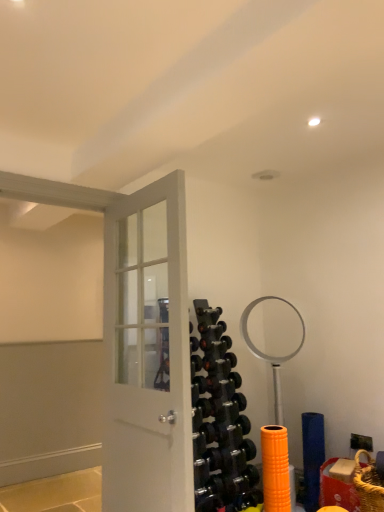
Image resolution: width=384 pixels, height=512 pixels. Describe the element at coordinates (218, 383) in the screenshot. I see `black rubber dumbbell at center, which is counted as the first dumbbell, starting from the bottom` at that location.

What do you see at coordinates (147, 353) in the screenshot?
I see `white glossy door at center` at bounding box center [147, 353].

This screenshot has width=384, height=512. What do you see at coordinates (219, 361) in the screenshot?
I see `black rubber dumbbell at center, placed as the 2th dumbbell when sorted from bottom to top` at bounding box center [219, 361].

Where is `black rubber dumbbell at center, which is counted as the first dumbbell, starting from the bottom`? black rubber dumbbell at center, which is counted as the first dumbbell, starting from the bottom is located at coordinates (218, 383).

From a real-world perspective, is black rubber dumbbell at center, arranged as the 3th dumbbell when viewed from the top, positioned over white glossy door at center based on gravity?

No, from a real-world perspective, black rubber dumbbell at center, arranged as the 3th dumbbell when viewed from the top, is not over white glossy door at center

At what (x,y) coordinates should I click in order to perform the action: click on the 1st dumbbell behind when counting from the white glossy door at center. Please return your answer as a coordinate pair (x, y). Looking at the image, I should click on (218, 383).

What's the angular difference between black rubber dumbbell at center, arranged as the 3th dumbbell when viewed from the top, and white glossy door at center's facing directions?

The angular difference between black rubber dumbbell at center, arranged as the 3th dumbbell when viewed from the top, and white glossy door at center is 89.5 degrees.

Does black rubber dumbbell at center, which is counted as the first dumbbell, starting from the bottom, have a greater height compared to white glossy door at center?

In fact, black rubber dumbbell at center, which is counted as the first dumbbell, starting from the bottom, may be shorter than white glossy door at center.

Considering the sizes of objects black rubber dumbbell at center, which is counted as the first dumbbell, starting from the top, and black rubber dumbbell at center, placed as the 2th dumbbell when sorted from bottom to top, in the image provided, who is taller, black rubber dumbbell at center, which is counted as the first dumbbell, starting from the top, or black rubber dumbbell at center, placed as the 2th dumbbell when sorted from bottom to top,?

With more height is black rubber dumbbell at center, placed as the 2th dumbbell when sorted from bottom to top.

From a real-world perspective, is black rubber dumbbell at center, acting as the 3th dumbbell starting from the bottom, above or below black rubber dumbbell at center, the 2th dumbbell in the top-to-bottom sequence?

From a real-world perspective, black rubber dumbbell at center, acting as the 3th dumbbell starting from the bottom, is physically above black rubber dumbbell at center, the 2th dumbbell in the top-to-bottom sequence.

Considering the positions of point (203, 344) and point (220, 361), is point (203, 344) closer or farther from the camera than point (220, 361)?

Point (203, 344).

Which of these two, black rubber dumbbell at center, acting as the 3th dumbbell starting from the bottom, or white glossy door at center, is wider?

With larger width is white glossy door at center.

Is white glossy door at center inside black rubber dumbbell at center, acting as the 3th dumbbell starting from the bottom?

No, white glossy door at center is not a part of black rubber dumbbell at center, acting as the 3th dumbbell starting from the bottom.

Can you confirm if black rubber dumbbell at center, which is counted as the first dumbbell, starting from the top, is shorter than white glossy door at center?

Yes.

How many degrees apart are the facing directions of black rubber dumbbell at center, acting as the 3th dumbbell starting from the bottom, and white glossy door at center?

92.3 degrees.

From the image's perspective, is black rubber dumbbell at center, arranged as the 3th dumbbell when viewed from the top, above black rubber dumbbell at center, acting as the 3th dumbbell starting from the bottom?

Actually, black rubber dumbbell at center, arranged as the 3th dumbbell when viewed from the top, appears below black rubber dumbbell at center, acting as the 3th dumbbell starting from the bottom, in the image.

Which is less distant, (197,378) or (214,347)?

Point (197,378) appears to be closer to the viewer than point (214,347).

Could you tell me if black rubber dumbbell at center, which is counted as the first dumbbell, starting from the bottom, is turned towards black rubber dumbbell at center, acting as the 3th dumbbell starting from the bottom?

No.

Is black rubber dumbbell at center, arranged as the 3th dumbbell when viewed from the top, positioned far away from black rubber dumbbell at center, which is counted as the first dumbbell, starting from the top?

black rubber dumbbell at center, arranged as the 3th dumbbell when viewed from the top, is near black rubber dumbbell at center, which is counted as the first dumbbell, starting from the top, not far away.

Locate an element on the screen. This screenshot has width=384, height=512. door that appears above the black rubber dumbbell at center, arranged as the 3th dumbbell when viewed from the top (from the image's perspective) is located at coordinates (147, 353).

From their relative heights in the image, would you say white glossy door at center is taller or shorter than black rubber dumbbell at center, which is counted as the first dumbbell, starting from the bottom?

white glossy door at center is taller than black rubber dumbbell at center, which is counted as the first dumbbell, starting from the bottom.

Does point (134, 263) lie behind point (213, 387)?

Yes, it is behind point (213, 387).

Does white glossy door at center come in front of black rubber dumbbell at center, which is counted as the first dumbbell, starting from the bottom?

Yes, white glossy door at center is closer to the viewer.

The height and width of the screenshot is (512, 384). In order to click on the 2nd dumbbell positioned above the black rubber dumbbell at center, which is counted as the first dumbbell, starting from the bottom (from a real-world perspective) in this screenshot , I will do `click(215, 343)`.

Is black rubber dumbbell at center, which is counted as the first dumbbell, starting from the top, wider or thinner than black rubber dumbbell at center, which is counted as the first dumbbell, starting from the bottom?

Clearly, black rubber dumbbell at center, which is counted as the first dumbbell, starting from the top, has less width compared to black rubber dumbbell at center, which is counted as the first dumbbell, starting from the bottom.

Would you say black rubber dumbbell at center, which is counted as the first dumbbell, starting from the top, is outside black rubber dumbbell at center, which is counted as the first dumbbell, starting from the bottom?

Indeed, black rubber dumbbell at center, which is counted as the first dumbbell, starting from the top, is completely outside black rubber dumbbell at center, which is counted as the first dumbbell, starting from the bottom.

Is black rubber dumbbell at center, which is counted as the first dumbbell, starting from the top, oriented away from black rubber dumbbell at center, arranged as the 3th dumbbell when viewed from the top?

No, black rubber dumbbell at center, which is counted as the first dumbbell, starting from the top,'s orientation is not away from black rubber dumbbell at center, arranged as the 3th dumbbell when viewed from the top.

Considering the positions of objects black rubber dumbbell at center, placed as the 2th dumbbell when sorted from bottom to top, and white glossy door at center in the image provided, who is more to the right, black rubber dumbbell at center, placed as the 2th dumbbell when sorted from bottom to top, or white glossy door at center?

From the viewer's perspective, black rubber dumbbell at center, placed as the 2th dumbbell when sorted from bottom to top, appears more on the right side.

Can you confirm if black rubber dumbbell at center, the 2th dumbbell in the top-to-bottom sequence, is shorter than white glossy door at center?

Yes, black rubber dumbbell at center, the 2th dumbbell in the top-to-bottom sequence, is shorter than white glossy door at center.

From the image's perspective, is black rubber dumbbell at center, placed as the 2th dumbbell when sorted from bottom to top, below white glossy door at center?

Indeed, from the image's perspective, black rubber dumbbell at center, placed as the 2th dumbbell when sorted from bottom to top, is shown beneath white glossy door at center.

Image resolution: width=384 pixels, height=512 pixels. What are the coordinates of `dumbbell that is the 1st object located behind the white glossy door at center` in the screenshot? It's located at (218, 383).

Locate an element on the screen. The width and height of the screenshot is (384, 512). the 1st dumbbell counting from the right side of the black rubber dumbbell at center, which is counted as the first dumbbell, starting from the top is located at coordinates (219, 361).

Based on their spatial positions, is black rubber dumbbell at center, placed as the 2th dumbbell when sorted from bottom to top, or white glossy door at center closer to black rubber dumbbell at center, which is counted as the first dumbbell, starting from the bottom?

black rubber dumbbell at center, placed as the 2th dumbbell when sorted from bottom to top.

From the image, which object appears to be farther from black rubber dumbbell at center, which is counted as the first dumbbell, starting from the top, white glossy door at center or black rubber dumbbell at center, the 2th dumbbell in the top-to-bottom sequence?

white glossy door at center.

Based on their spatial positions, is black rubber dumbbell at center, placed as the 2th dumbbell when sorted from bottom to top, or white glossy door at center further from black rubber dumbbell at center, acting as the 3th dumbbell starting from the bottom?

Among the two, white glossy door at center is located further to black rubber dumbbell at center, acting as the 3th dumbbell starting from the bottom.

Based on their spatial positions, is black rubber dumbbell at center, placed as the 2th dumbbell when sorted from bottom to top, or black rubber dumbbell at center, which is counted as the first dumbbell, starting from the top, further from black rubber dumbbell at center, arranged as the 3th dumbbell when viewed from the top?

black rubber dumbbell at center, which is counted as the first dumbbell, starting from the top, lies further to black rubber dumbbell at center, arranged as the 3th dumbbell when viewed from the top, than the other object.

From the image, which object appears to be nearer to white glossy door at center, black rubber dumbbell at center, acting as the 3th dumbbell starting from the bottom, or black rubber dumbbell at center, arranged as the 3th dumbbell when viewed from the top?

Based on the image, black rubber dumbbell at center, arranged as the 3th dumbbell when viewed from the top, appears to be nearer to white glossy door at center.

When comparing their distances from black rubber dumbbell at center, arranged as the 3th dumbbell when viewed from the top, does white glossy door at center or black rubber dumbbell at center, which is counted as the first dumbbell, starting from the top, seem further?

white glossy door at center is further to black rubber dumbbell at center, arranged as the 3th dumbbell when viewed from the top.

Estimate the real-world distances between objects in this image. Which object is closer to black rubber dumbbell at center, the 2th dumbbell in the top-to-bottom sequence, black rubber dumbbell at center, which is counted as the first dumbbell, starting from the bottom, or white glossy door at center?

black rubber dumbbell at center, which is counted as the first dumbbell, starting from the bottom, is closer to black rubber dumbbell at center, the 2th dumbbell in the top-to-bottom sequence.

Considering their positions, is black rubber dumbbell at center, arranged as the 3th dumbbell when viewed from the top, positioned further to white glossy door at center than black rubber dumbbell at center, acting as the 3th dumbbell starting from the bottom?

The object further to white glossy door at center is black rubber dumbbell at center, acting as the 3th dumbbell starting from the bottom.

Identify the location of dumbbell between white glossy door at center and black rubber dumbbell at center, placed as the 2th dumbbell when sorted from bottom to top, along the z-axis. (218, 383).

Find the location of a particular element. This screenshot has width=384, height=512. dumbbell between black rubber dumbbell at center, acting as the 3th dumbbell starting from the bottom, and black rubber dumbbell at center, arranged as the 3th dumbbell when viewed from the top, in the up-down direction is located at coordinates (219, 361).